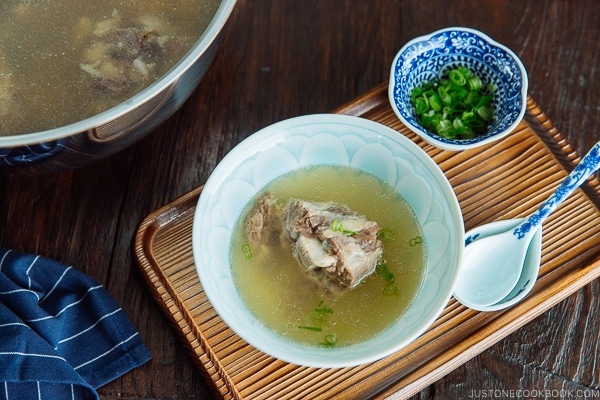
Identify the location of grain lines in wood table. The height and width of the screenshot is (400, 600). (541, 23), (575, 347), (564, 343), (282, 28), (115, 244).